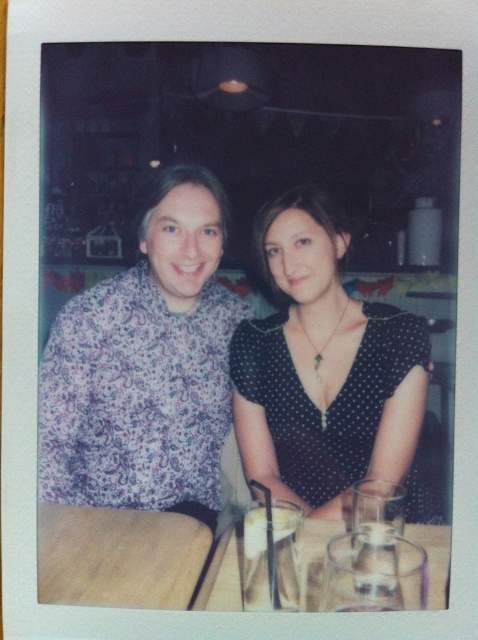
Question: Can you confirm if polka dot dress at center is positioned below wooden table at lower left?

Choices:
 (A) yes
 (B) no

Answer: (B)

Question: Does polka dot dress at center have a greater width compared to wooden table at lower left?

Choices:
 (A) yes
 (B) no

Answer: (A)

Question: Among these points, which one is farthest from the camera?

Choices:
 (A) (80, 582)
 (B) (173, 426)
 (C) (249, 406)

Answer: (C)

Question: Which point is closer to the camera taking this photo?

Choices:
 (A) (325, 424)
 (B) (180, 499)
 (C) (312, 541)
 (D) (201, 524)

Answer: (C)

Question: Is polka dot dress at center bigger than black dotted dress at center?

Choices:
 (A) no
 (B) yes

Answer: (B)

Question: Which of these objects is positioned closest to the polka dot dress at center?

Choices:
 (A) clear glass table at center
 (B) wooden table at lower left
 (C) black dotted dress at center

Answer: (C)